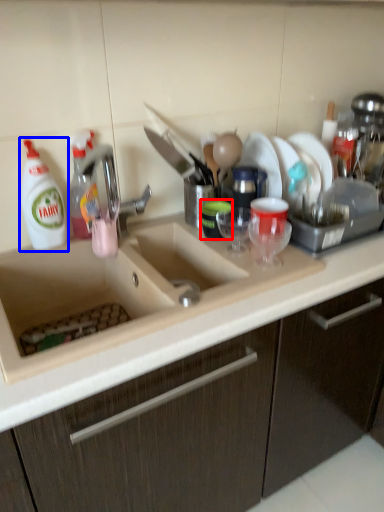
Question: Among these objects, which one is farthest to the camera, tableware (highlighted by a red box) or cleaning product (highlighted by a blue box)?

Choices:
 (A) tableware
 (B) cleaning product

Answer: (A)